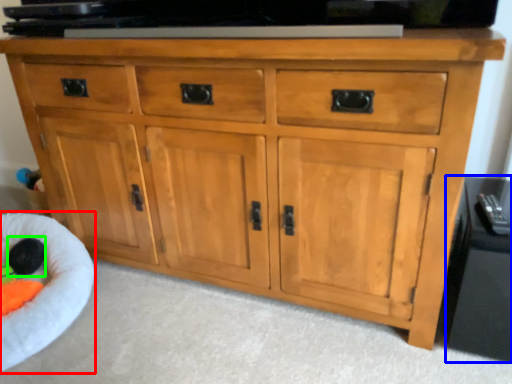
Question: Based on their relative distances, which object is nearer to infant bed (highlighted by a red box)? Choose from side cabinet (highlighted by a blue box) and toy (highlighted by a green box).

Choices:
 (A) side cabinet
 (B) toy

Answer: (B)